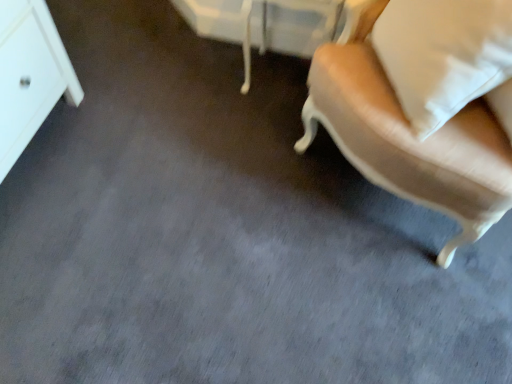
Question: From the image's perspective, does beige fabric chair at right appear higher than white soft pillow at upper right?

Choices:
 (A) no
 (B) yes

Answer: (B)

Question: Is beige fabric chair at right not inside white soft pillow at upper right?

Choices:
 (A) no
 (B) yes

Answer: (B)

Question: From the image's perspective, would you say beige fabric chair at right is shown under white soft pillow at upper right?

Choices:
 (A) yes
 (B) no

Answer: (B)

Question: Is beige fabric chair at right touching white soft pillow at upper right?

Choices:
 (A) yes
 (B) no

Answer: (B)

Question: Considering the relative sizes of beige fabric chair at right and white soft pillow at upper right in the image provided, is beige fabric chair at right thinner than white soft pillow at upper right?

Choices:
 (A) no
 (B) yes

Answer: (A)

Question: Does point (203, 36) appear closer or farther from the camera than point (477, 34)?

Choices:
 (A) farther
 (B) closer

Answer: (A)

Question: Is white glossy vanity at upper center inside the boundaries of white soft pillow at upper right, or outside?

Choices:
 (A) inside
 (B) outside

Answer: (B)

Question: Is white glossy vanity at upper center wider or thinner than white soft pillow at upper right?

Choices:
 (A) thin
 (B) wide

Answer: (A)

Question: Considering their positions, is white glossy vanity at upper center located in front of or behind white soft pillow at upper right?

Choices:
 (A) front
 (B) behind

Answer: (B)

Question: In the image, is white soft pillow at upper right on the left side or the right side of beige fabric chair at right?

Choices:
 (A) left
 (B) right

Answer: (B)

Question: Based on their sizes in the image, would you say white soft pillow at upper right is bigger or smaller than beige fabric chair at right?

Choices:
 (A) big
 (B) small

Answer: (B)

Question: From a real-world perspective, relative to beige fabric chair at right, is white soft pillow at upper right vertically above or below?

Choices:
 (A) above
 (B) below

Answer: (A)

Question: Is white soft pillow at upper right spatially inside beige fabric chair at right, or outside of it?

Choices:
 (A) outside
 (B) inside

Answer: (B)

Question: Is beige fabric chair at right bigger or smaller than white glossy vanity at upper center?

Choices:
 (A) big
 (B) small

Answer: (A)

Question: Relative to white glossy vanity at upper center, is beige fabric chair at right in front or behind?

Choices:
 (A) behind
 (B) front

Answer: (B)